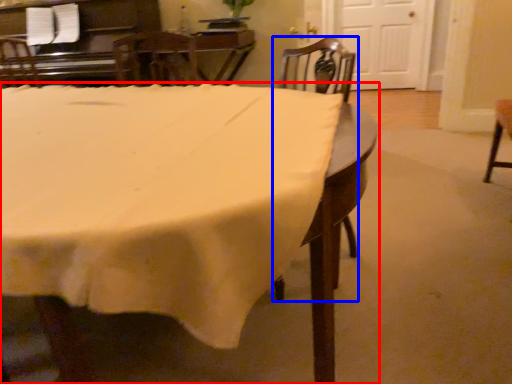
Question: Which object appears closest to the camera in this image, table (highlighted by a red box) or chair (highlighted by a blue box)?

Choices:
 (A) table
 (B) chair

Answer: (A)